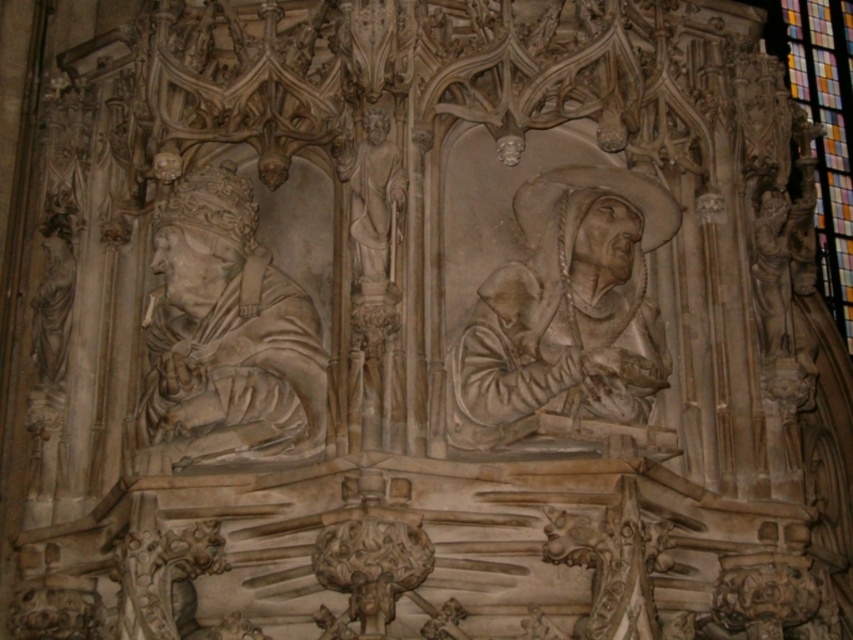
From the picture: You are an art conservator examining the gray stone statue at center. Based on the coordinates provided, can you confirm if the statue is positioned closer to the top or bottom of the image?

The gray stone statue at center is located at coordinates point (567,317). Since the y coordinate 0.666 is closer to 1.0, the statue is positioned closer to the bottom of the image.

You are an art conservator examining the sculpture and stained glass in the Gothic framework. Which object is positioned nearer to your viewpoint? Please refer to the gray stone statue at center and the stained glass at upper right in your answer.

The gray stone statue at center is closer to the viewer than the stained glass at upper right.

You are an art conservator examining the stone relief sculpture. You need to clean the white marble statue at left and the white marble statue at center. Based on their positions, which statue is positioned lower?

The white marble statue at left is located below the white marble statue at center, so it is positioned lower.